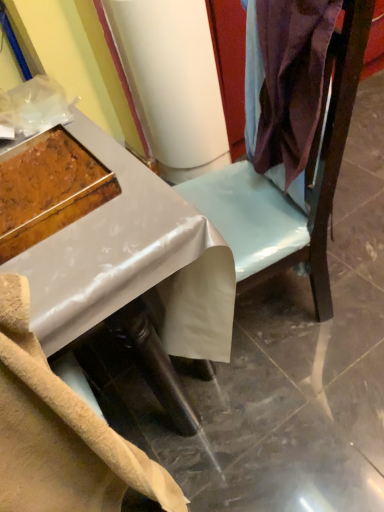
Where is `space that is in front of wooden tray at left`? The width and height of the screenshot is (384, 512). space that is in front of wooden tray at left is located at coordinates point(72,263).